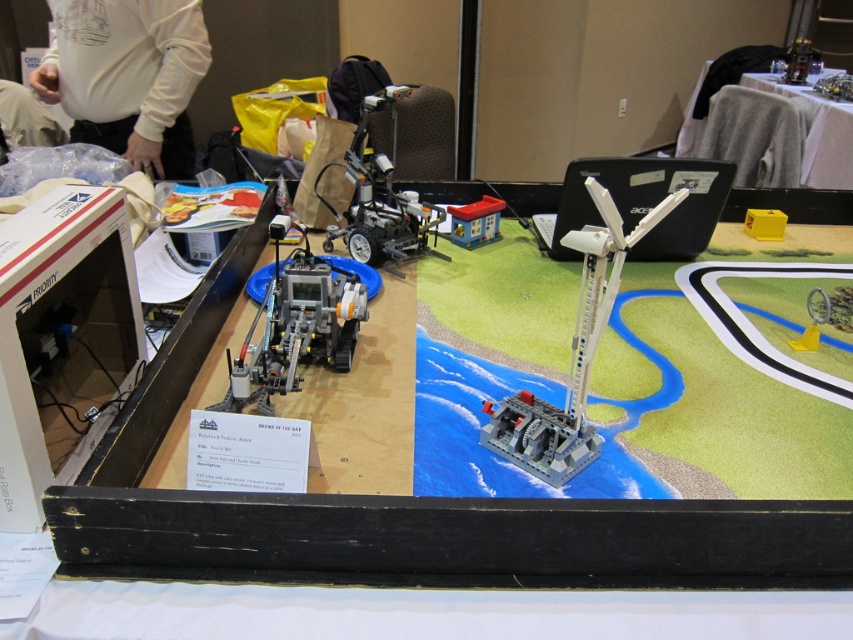
Question: Which of these objects is positioned farthest from the plastic toy house at center?

Choices:
 (A) yellow plastic toy at center
 (B) matte black robot at center
 (C) yellow plastic box at upper right
 (D) white fabric table at upper right

Answer: (D)

Question: Does translucent gray wind turbine at center appear under white fabric table at upper right?

Choices:
 (A) no
 (B) yes

Answer: (B)

Question: Which object is the closest to the white fabric table at upper right?

Choices:
 (A) white matte shirt at upper left
 (B) yellow plastic box at upper right
 (C) plastic toy house at center
 (D) translucent gray wind turbine at center

Answer: (B)

Question: Which object is the farthest from the plastic toy house at center?

Choices:
 (A) white fabric table at upper right
 (B) matte black robot at center
 (C) yellow plastic toy at center
 (D) yellow plastic box at upper right

Answer: (A)

Question: Does matte black robot at center come in front of yellow plastic toy at center?

Choices:
 (A) yes
 (B) no

Answer: (A)

Question: Does matte black wheelchair at center appear over yellow plastic box at upper right?

Choices:
 (A) yes
 (B) no

Answer: (A)